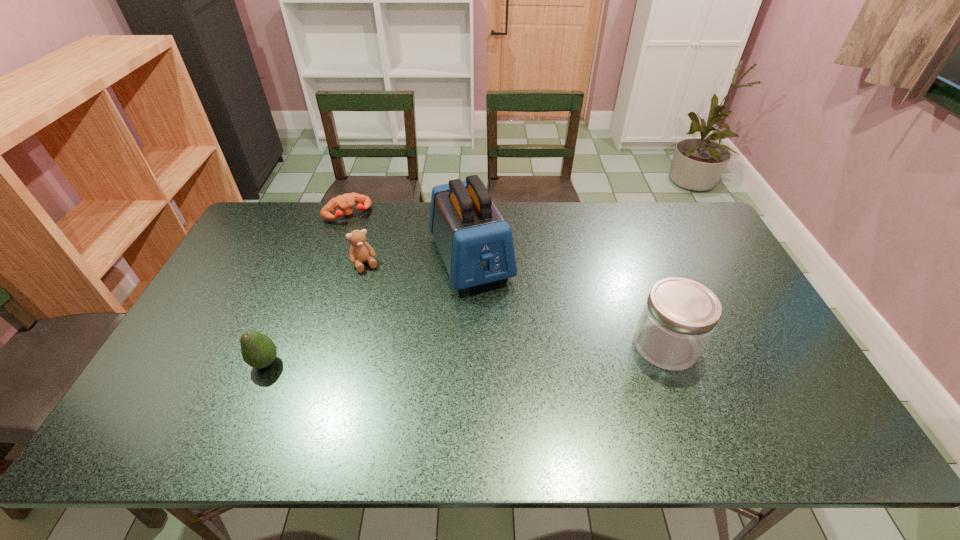
Identify the location of vacant area that lies between the second object from right to left and the avocado. This screenshot has width=960, height=540. (368, 310).

Where is `free spot between the shortest object and the avocado`? The image size is (960, 540). free spot between the shortest object and the avocado is located at coordinates (306, 288).

This screenshot has width=960, height=540. In order to click on free space that is in between the teddy bear and the avocado in this screenshot , I will do `click(315, 314)`.

Locate an element on the screen. This screenshot has height=540, width=960. unoccupied position between the shortest object and the toaster is located at coordinates (409, 236).

Select which object is the third closest to the puncher. Please provide its 2D coordinates. Your answer should be formatted as a tuple, i.e. [(x, y)], where the tuple contains the x and y coordinates of a point satisfying the conditions above.

[(258, 351)]

Where is `object that is the third closest one to the teddy bear`? The height and width of the screenshot is (540, 960). object that is the third closest one to the teddy bear is located at coordinates (258, 351).

This screenshot has width=960, height=540. In order to click on free space in the image that satisfies the following two spatial constraints: 1. on the front side of the puncher; 2. on the left side of the teddy bear in this screenshot , I will do `click(329, 264)`.

Locate an element on the screen. free space that satisfies the following two spatial constraints: 1. on the back side of the rightmost object; 2. on the left side of the avocado is located at coordinates (273, 346).